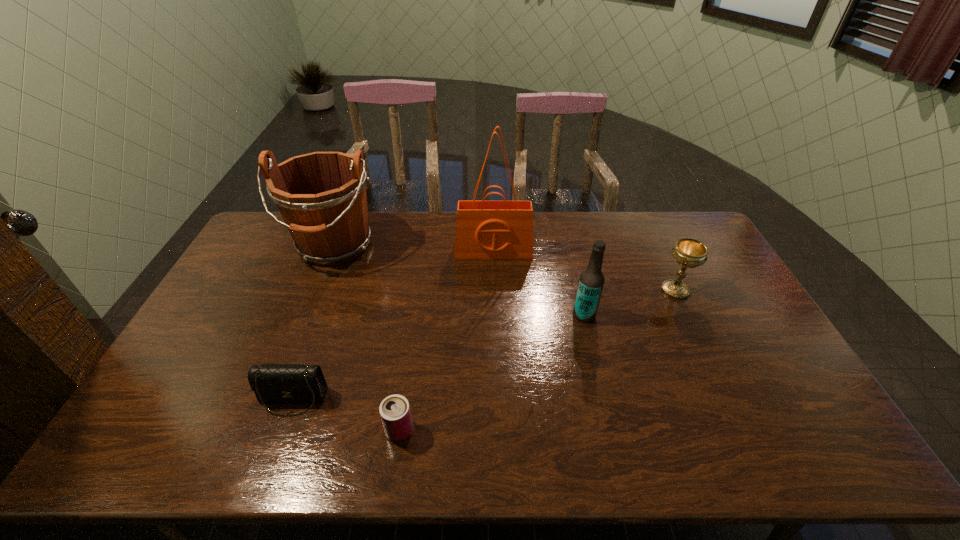
You are a GUI agent. You are given a task and a screenshot of the screen. Output one action in this format:
    pyautogui.click(x=<x>, y=<y>)
    Task: Click on the tote bag
    This screenshot has width=960, height=540.
    Given the screenshot: What is the action you would take?
    pyautogui.click(x=484, y=229)

Locate an element on the screen. the tallest object is located at coordinates (484, 229).

Identify the location of bucket. (321, 196).

Find the location of a particular element. the fourth shortest object is located at coordinates (591, 281).

Locate an element on the screen. The image size is (960, 540). the second object from right to left is located at coordinates (591, 281).

Find the location of a particular element. Image resolution: width=960 pixels, height=540 pixels. the fourth tallest object is located at coordinates (689, 253).

Where is `chalice`? This screenshot has width=960, height=540. chalice is located at coordinates (689, 253).

Identify the location of clutch bag. This screenshot has width=960, height=540. (275, 384).

In order to click on the nearest object in this screenshot , I will do `click(395, 413)`.

I want to click on can, so click(395, 413).